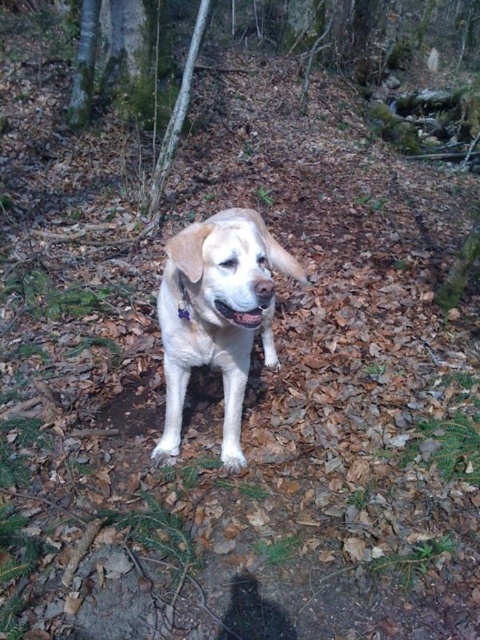
Question: Among these objects, which one is farthest from the camera?

Choices:
 (A) pink glossy tongue at center
 (B) white fur dog at center

Answer: (A)

Question: Can you confirm if white fur dog at center is positioned above pink glossy tongue at center?

Choices:
 (A) yes
 (B) no

Answer: (B)

Question: Is white fur dog at center smaller than pink glossy tongue at center?

Choices:
 (A) no
 (B) yes

Answer: (A)

Question: Can you confirm if white fur dog at center is wider than pink glossy tongue at center?

Choices:
 (A) no
 (B) yes

Answer: (B)